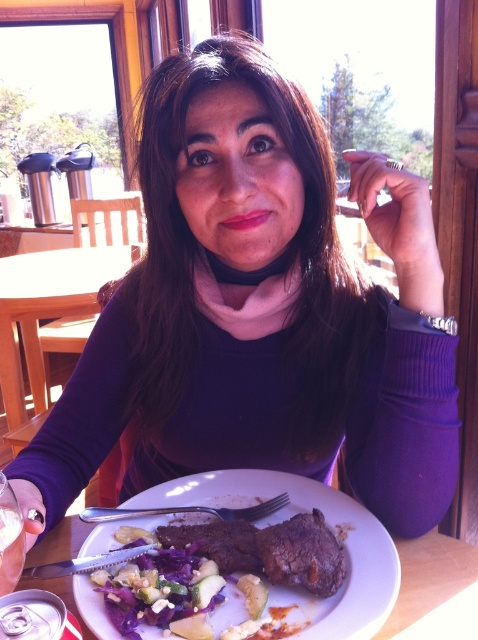
Question: Can you confirm if shiny purple salad at plate center is smaller than brown seared steak at plate center?

Choices:
 (A) yes
 (B) no

Answer: (B)

Question: Is brown seared steak at plate center wider than silver metallic fork at plate center?

Choices:
 (A) yes
 (B) no

Answer: (B)

Question: Which of the following is the closest to the observer?

Choices:
 (A) dark brown steak at plate center
 (B) wooden table at center
 (C) matte brown steak at center
 (D) brown seared steak at plate center

Answer: (C)

Question: Does wooden table at center appear over silver metallic fork at plate center?

Choices:
 (A) no
 (B) yes

Answer: (B)

Question: Estimate the real-world distances between objects in this image. Which object is closer to the wooden table at center?

Choices:
 (A) matte brown steak at center
 (B) silver metallic fork at plate center
 (C) brown seared steak at plate center

Answer: (A)

Question: Which object is the farthest from the brown seared steak at plate center?

Choices:
 (A) silver metallic fork at plate center
 (B) wooden table at center
 (C) shiny purple salad at plate center

Answer: (B)